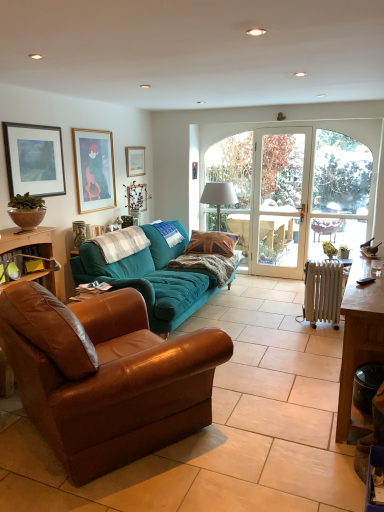
Question: Can you confirm if metallic radiator at lower right is positioned to the right of wooden picture frame at upper left, which ranks as the 2th picture frame in front-to-back order?

Choices:
 (A) yes
 (B) no

Answer: (A)

Question: Would you consider metallic radiator at lower right to be distant from wooden picture frame at upper left, the 2th picture frame from the right?

Choices:
 (A) no
 (B) yes

Answer: (B)

Question: Can you confirm if metallic radiator at lower right is shorter than wooden picture frame at upper left, which ranks as the second picture frame in left-to-right order?

Choices:
 (A) no
 (B) yes

Answer: (B)

Question: Could you tell me if metallic radiator at lower right is facing wooden picture frame at upper left, the 2th picture frame from the right?

Choices:
 (A) no
 (B) yes

Answer: (B)

Question: Is wooden picture frame at upper left, which ranks as the 2th picture frame in front-to-back order, surrounded by metallic radiator at lower right?

Choices:
 (A) no
 (B) yes

Answer: (A)

Question: Is point (216, 201) closer or farther from the camera than point (72, 227)?

Choices:
 (A) farther
 (B) closer

Answer: (A)

Question: Considering the positions of white fabric lampshade at center and matte ceramic vase at upper left in the image, is white fabric lampshade at center taller or shorter than matte ceramic vase at upper left?

Choices:
 (A) short
 (B) tall

Answer: (B)

Question: From the image's perspective, is white fabric lampshade at center above or below matte ceramic vase at upper left?

Choices:
 (A) below
 (B) above

Answer: (B)

Question: From a real-world perspective, is white fabric lampshade at center above or below matte ceramic vase at upper left?

Choices:
 (A) below
 (B) above

Answer: (B)

Question: From the image's perspective, relative to matte black picture frame at upper left, which appears as the first picture frame when viewed from the front, is wooden picture frame at upper left, which ranks as the second picture frame in left-to-right order, above or below?

Choices:
 (A) below
 (B) above

Answer: (B)

Question: In the image, is wooden picture frame at upper left, which ranks as the second picture frame in left-to-right order, positioned in front of or behind matte black picture frame at upper left, arranged as the 1th picture frame when viewed from the left?

Choices:
 (A) front
 (B) behind

Answer: (B)

Question: In terms of height, does wooden picture frame at upper left, marked as the second picture frame in a back-to-front arrangement, look taller or shorter compared to matte black picture frame at upper left, which is counted as the third picture frame, starting from the back?

Choices:
 (A) tall
 (B) short

Answer: (A)

Question: Looking at the image, does wooden picture frame at upper left, the 2th picture frame from the right, seem bigger or smaller compared to matte black picture frame at upper left, which is counted as the third picture frame, starting from the back?

Choices:
 (A) big
 (B) small

Answer: (A)

Question: Considering their positions, is matte black picture frame at upper left, which appears as the first picture frame when viewed from the front, located in front of or behind matte ceramic vase at upper left?

Choices:
 (A) behind
 (B) front

Answer: (B)

Question: From the image's perspective, is matte black picture frame at upper left, arranged as the 1th picture frame when viewed from the left, above or below matte ceramic vase at upper left?

Choices:
 (A) below
 (B) above

Answer: (B)